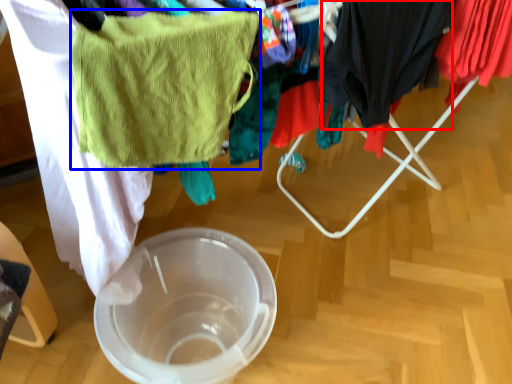
Question: Which point is closer to the camera, clothing (highlighted by a red box) or towel/napkin (highlighted by a blue box)?

Choices:
 (A) clothing
 (B) towel/napkin

Answer: (B)